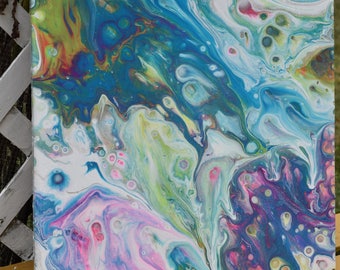
At what (x,y) coordinates should I click in order to perform the action: click on orange paint. Please return your answer as a coordinate pair (x, y). The width and height of the screenshot is (340, 270). Looking at the image, I should click on (62, 56).